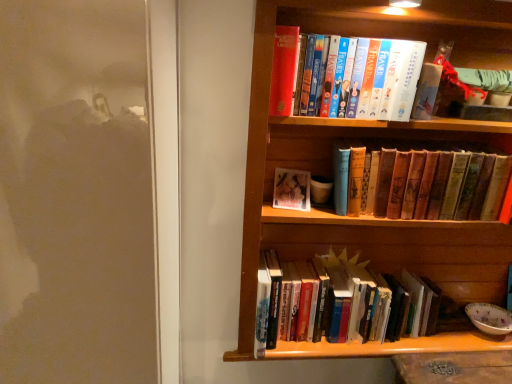
Question: From a real-world perspective, is hardcover books at center, acting as the first book starting from the bottom, located higher than vintage leather book at center, acting as the 2th book starting from the top?

Choices:
 (A) yes
 (B) no

Answer: (B)

Question: Can you confirm if hardcover books at center, which is counted as the third book, starting from the top, is wider than vintage leather book at center, acting as the 2th book starting from the top?

Choices:
 (A) yes
 (B) no

Answer: (A)

Question: Does hardcover books at center, acting as the first book starting from the bottom, turn towards vintage leather book at center, positioned as the 2th book in bottom-to-top order?

Choices:
 (A) no
 (B) yes

Answer: (A)

Question: Considering the relative sizes of hardcover books at center, acting as the first book starting from the bottom, and vintage leather book at center, acting as the 2th book starting from the top, in the image provided, is hardcover books at center, acting as the first book starting from the bottom, bigger than vintage leather book at center, acting as the 2th book starting from the top,?

Choices:
 (A) yes
 (B) no

Answer: (A)

Question: From the image's perspective, is hardcover books at center, which is counted as the third book, starting from the top, located beneath vintage leather book at center, acting as the 2th book starting from the top?

Choices:
 (A) no
 (B) yes

Answer: (B)

Question: Is hardcover books at center, acting as the first book starting from the bottom, surrounded by hardcover book at upper center, the 1th book in the top-to-bottom sequence?

Choices:
 (A) yes
 (B) no

Answer: (B)

Question: Is hardcover book at upper center, the 1th book in the top-to-bottom sequence, turned away from hardcover books at center, which is counted as the third book, starting from the top?

Choices:
 (A) yes
 (B) no

Answer: (B)

Question: Is hardcover book at upper center, the 1th book in the top-to-bottom sequence, to the right of hardcover books at center, acting as the first book starting from the bottom, from the viewer's perspective?

Choices:
 (A) yes
 (B) no

Answer: (B)

Question: Is hardcover book at upper center, which is counted as the third book, starting from the bottom, taller than hardcover books at center, acting as the first book starting from the bottom?

Choices:
 (A) yes
 (B) no

Answer: (B)

Question: Is hardcover book at upper center, which is counted as the third book, starting from the bottom, with hardcover books at center, acting as the first book starting from the bottom?

Choices:
 (A) yes
 (B) no

Answer: (B)

Question: Is wooden bookcase at upper right far from hardcover books at center, acting as the first book starting from the bottom?

Choices:
 (A) no
 (B) yes

Answer: (A)